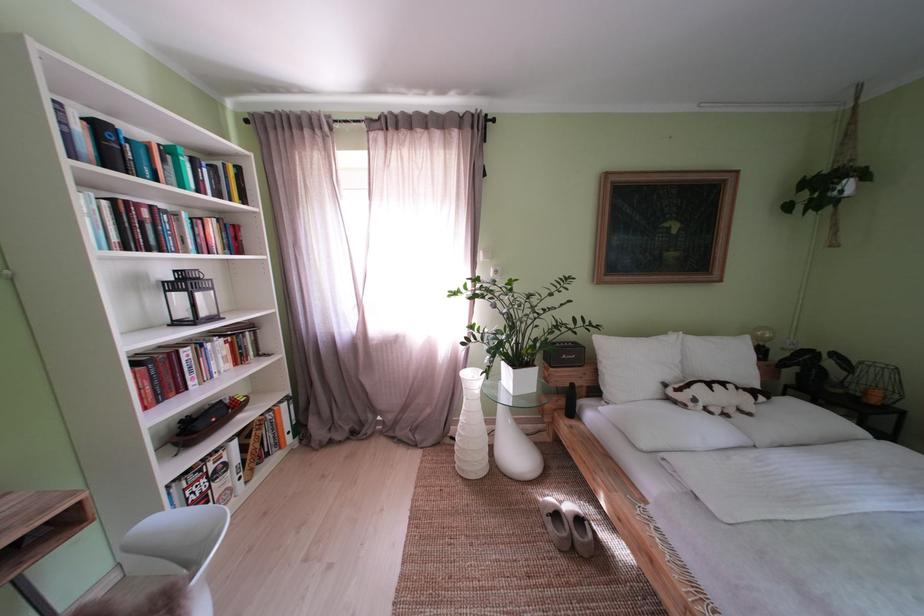
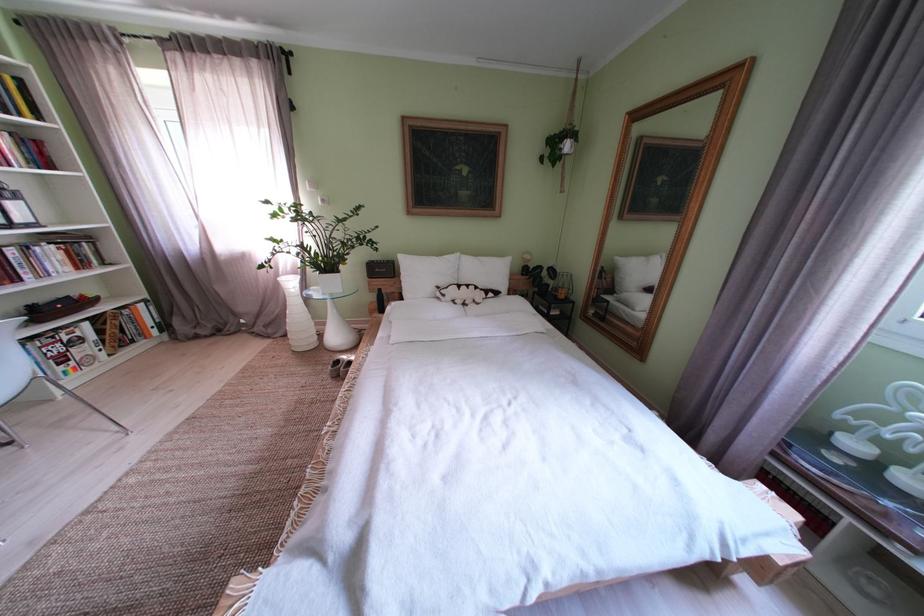
Find the pixel in the second image that matches point (723, 344) in the first image.

(492, 264)